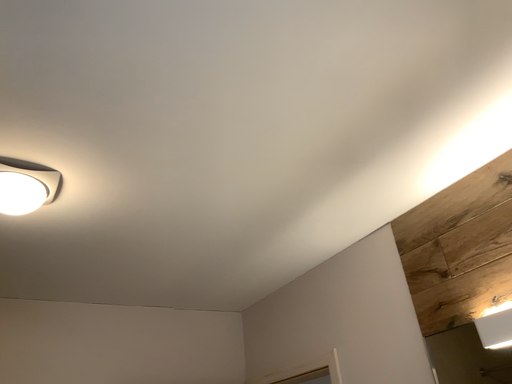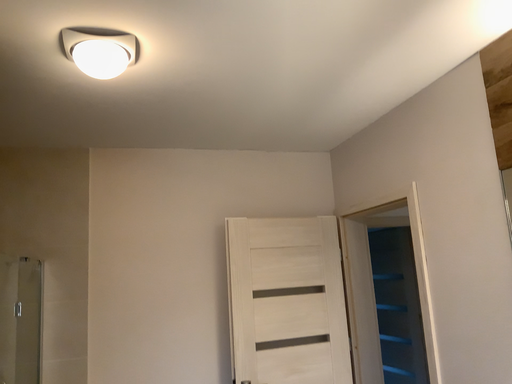
Question: Which way did the camera rotate in the video?

Choices:
 (A) rotated left
 (B) rotated right

Answer: (A)